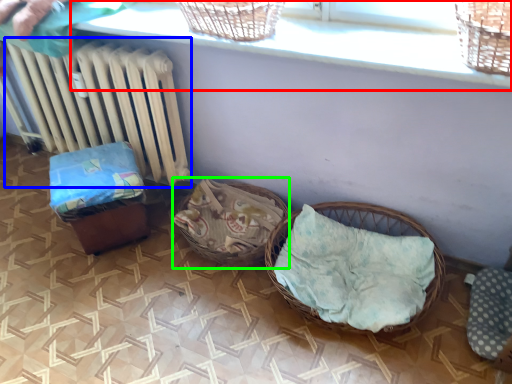
Question: Considering the real-world distances, which object is farthest from window sill (highlighted by a red box)? radiator (highlighted by a blue box) or basket (highlighted by a green box)?

Choices:
 (A) radiator
 (B) basket

Answer: (B)